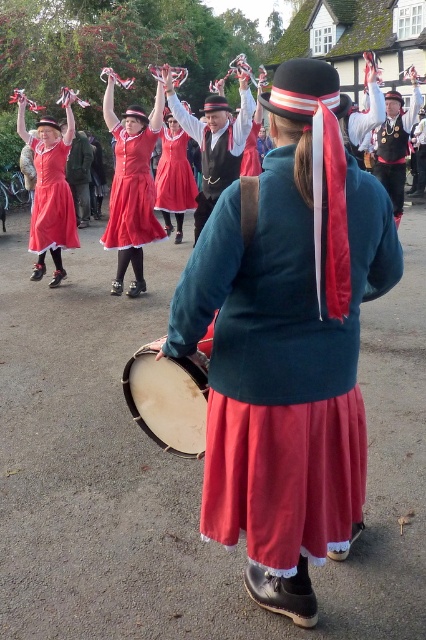
Who is lower down, light brown drum at center or velvet red skirt at center?

light brown drum at center is below.

Can you confirm if light brown drum at center is positioned below velvet red skirt at center?

Correct, light brown drum at center is located below velvet red skirt at center.

Who is more forward, (175, 449) or (176, 113)?

Positioned in front is point (175, 449).

What are the coordinates of `light brown drum at center` in the screenshot? It's located at (167, 401).

Between matte red dress at left and velvet red skirt at center, which one is positioned lower?

Positioned lower is velvet red skirt at center.

Does matte red dress at left have a greater height compared to velvet red skirt at center?

Indeed, matte red dress at left has a greater height compared to velvet red skirt at center.

Locate an element on the screen. matte red dress at left is located at coordinates (49, 188).

Between point (290, 387) and point (137, 196), which one is positioned behind?

The point (137, 196) is behind.

Can you confirm if matte teal jacket at center is positioned above matte red dress at upper center?

No.

Is point (284, 248) positioned after point (126, 132)?

No.

Locate an element on the screen. The image size is (426, 640). matte teal jacket at center is located at coordinates (287, 342).